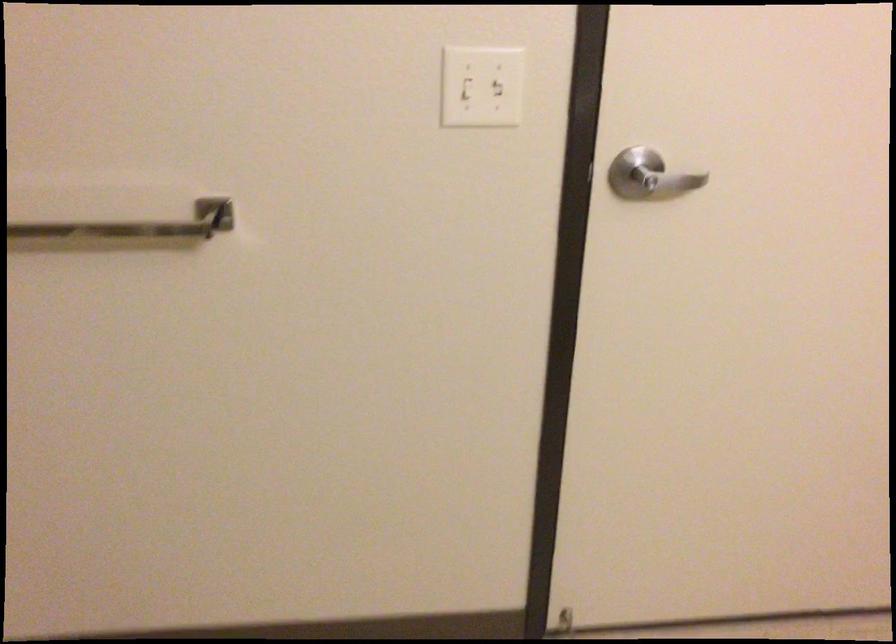
Describe the element at coordinates (470, 84) in the screenshot. I see `the white light switch` at that location.